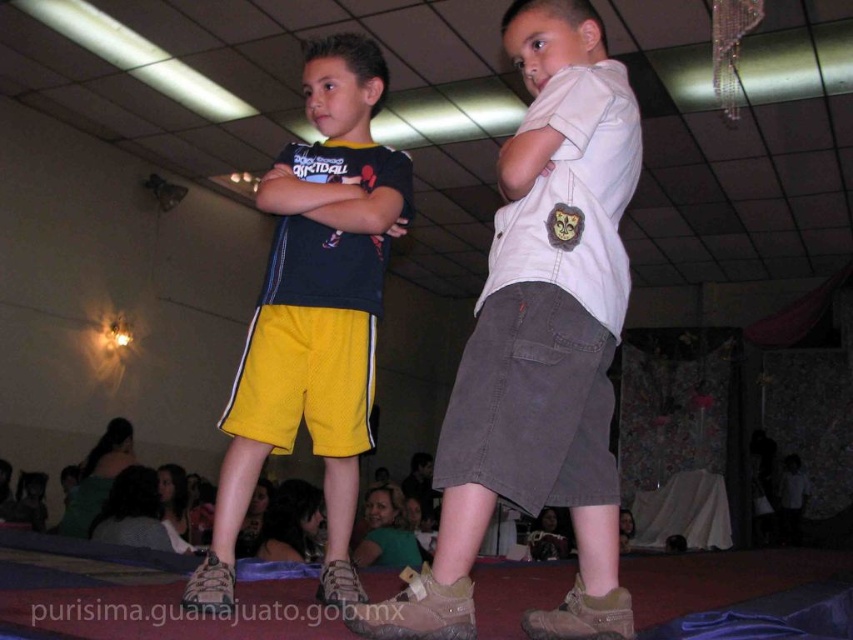
Is point (549, 106) in front of point (352, 184)?

Yes, point (549, 106) is in front of point (352, 184).

Does white matte shirt at upper center have a lesser height compared to matte black shirt at center?

No, white matte shirt at upper center is not shorter than matte black shirt at center.

Between point (509, 180) and point (292, 202), which one is positioned behind?

Point (292, 202)

The image size is (853, 640). Find the location of `white matte shirt at upper center`. white matte shirt at upper center is located at coordinates (550, 129).

Does yellow mesh shorts at left have a lesser width compared to matte black shirt at center?

In fact, yellow mesh shorts at left might be wider than matte black shirt at center.

Locate an element on the screen. The image size is (853, 640). yellow mesh shorts at left is located at coordinates (314, 314).

Which of these two, matte yellow shorts at center or yellow mesh shorts at left, stands shorter?

With less height is matte yellow shorts at center.

Between point (514, 252) and point (310, 48), which one is positioned in front?

Point (514, 252)

Which is in front, point (447, 580) or point (337, 54)?

Positioned in front is point (447, 580).

Find the location of a particular element. matte yellow shorts at center is located at coordinates (538, 340).